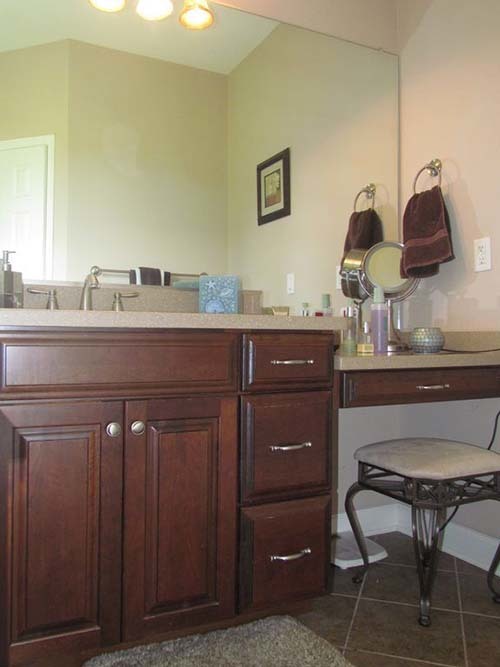
Identify the location of towels. The height and width of the screenshot is (667, 500). (153, 273), (357, 221), (435, 211).